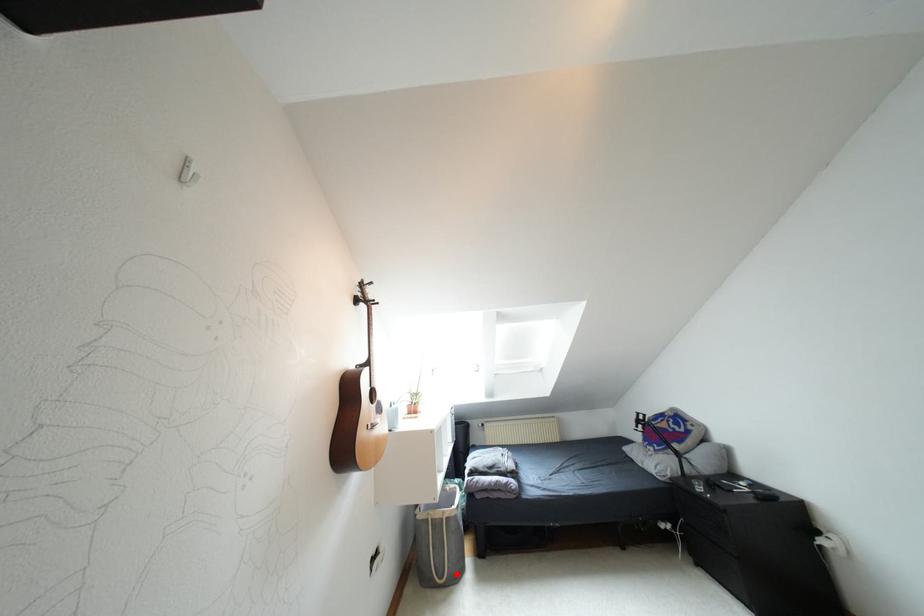
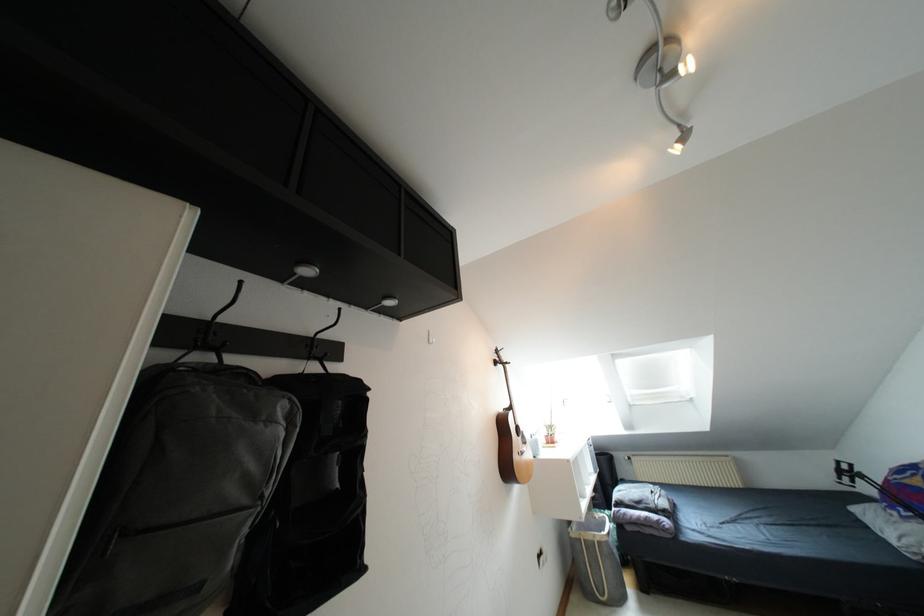
Question: A red point is marked in image1. In image2, is the corresponding 3D point closer to the camera or farther? Reply with the corresponding letter.

Choices:
 (A) The corresponding 3D point is closer.
 (B) The corresponding 3D point is farther.

Answer: (A)